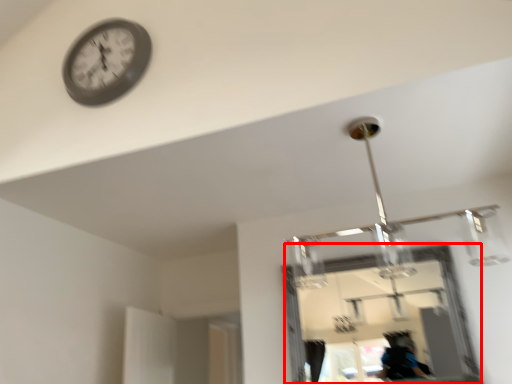
Question: From the image's perspective, considering the relative positions of mirror (annotated by the red box) and wall clock in the image provided, where is mirror (annotated by the red box) located with respect to the staircase?

Choices:
 (A) below
 (B) above

Answer: (A)